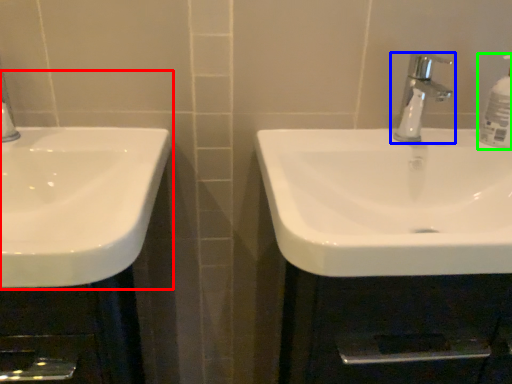
Question: Which object is the closest to the sink (highlighted by a red box)? Choose among these: tap (highlighted by a blue box) or soap dispenser (highlighted by a green box).

Choices:
 (A) tap
 (B) soap dispenser

Answer: (A)